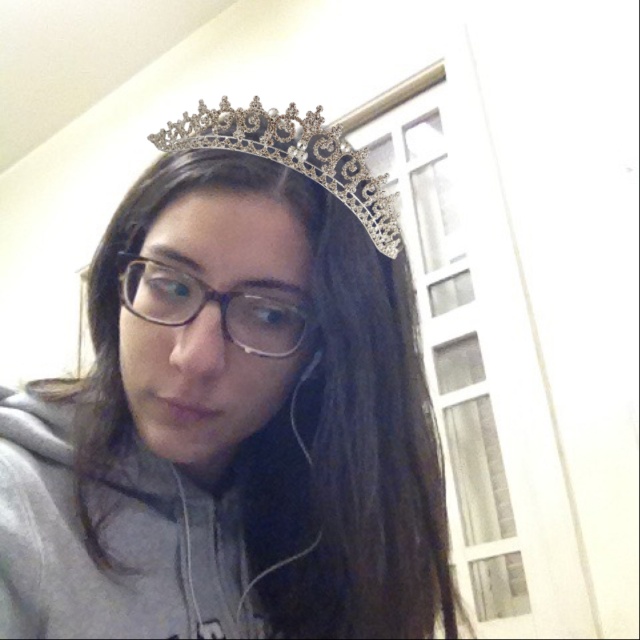
Based on the description, can you determine if the silver metallic crown at upper center is wider than the silver metallic tiara at upper center?

The silver metallic crown at upper center might be wider than silver metallic tiara at upper center according to the description.

You are standing in the room and want to know which of the two points, point (380,285) or point (268,150), is closer to you. Can you determine this based on their positions?

Point (380,285) is further to the viewer than point (268,150), so the closer point to you is point (268,150).

Consider the image. You are a photographer setting up a portrait shoot. You notice the silver metallic tiara at upper center and the transparent plastic glasses at center. Which object would you need to adjust the camera focus on first if you want to ensure both are in focus, considering their sizes?

The silver metallic tiara at upper center is much taller than the transparent plastic glasses at center, so you should focus on the silver metallic tiara at upper center first to ensure its details are sharp before adjusting for the smaller glasses.